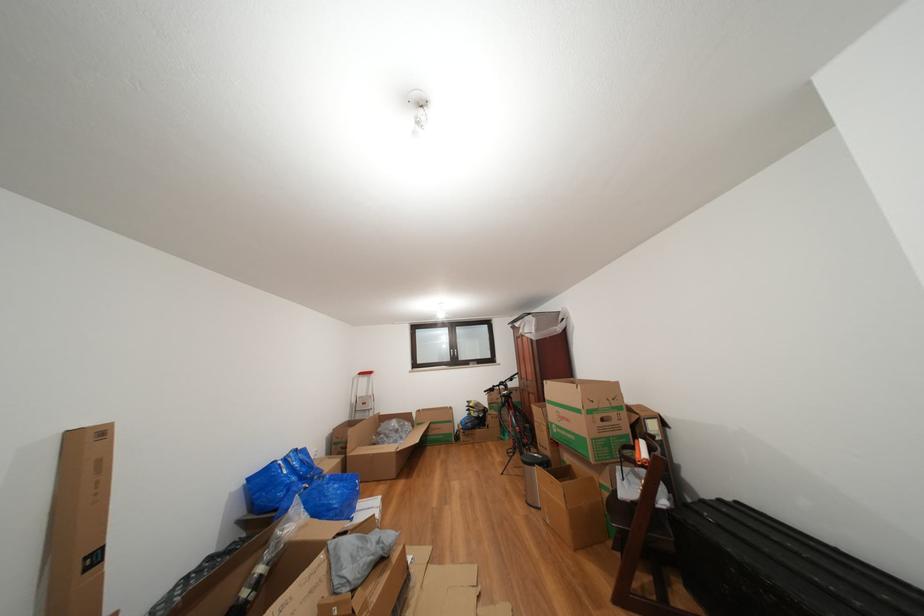
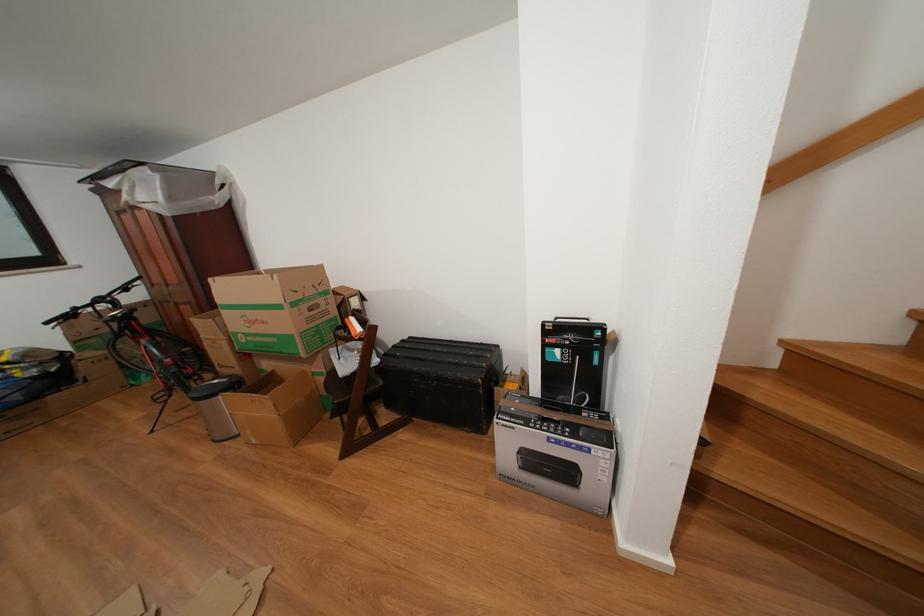
Find the pixel in the second image that matches (x=576, y=426) in the first image.

(272, 328)